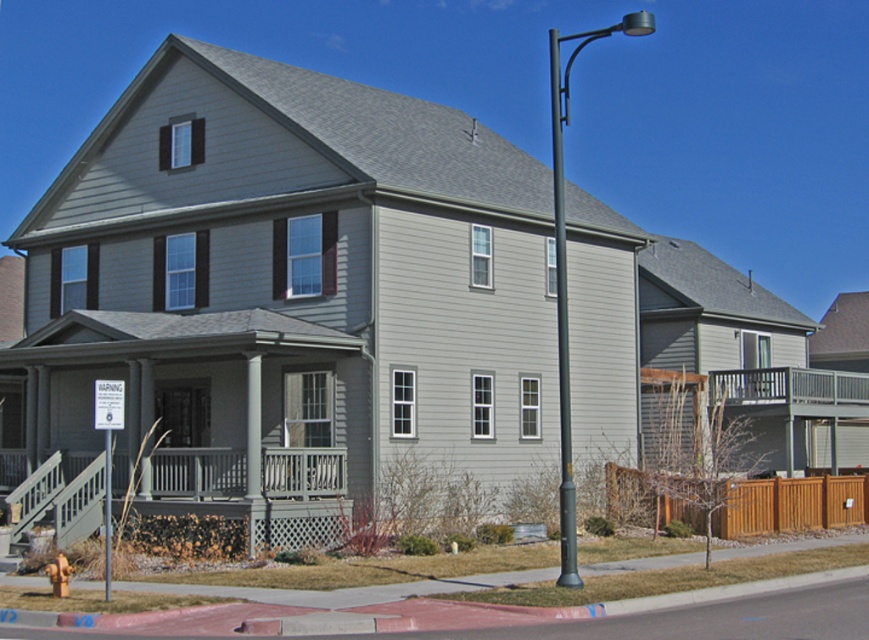
Consider the image. You are standing in front of the house and want to walk from the matte gray porch at lower left to the black metal pole at right. Which direction should you move relative to the house?

You should move to the right relative to the house because the matte gray porch at lower left is located below the black metal pole at right, indicating it is positioned to the left side of the pole.

You are standing in front of the house and want to compare the height of the objects. Which one is shorter between the matte gray porch at lower left and the metallic gray pole at right?

The matte gray porch at lower left is shorter than the metallic gray pole at right.